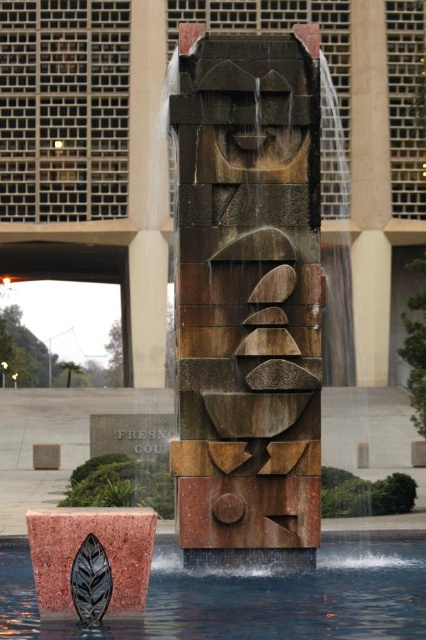
Which is more to the right, metallic water at leaf bottom or rustic stone sculpture at center?

Positioned to the right is metallic water at leaf bottom.

Who is taller, metallic water at leaf bottom or rustic stone sculpture at center?

rustic stone sculpture at center is taller.

Locate an element on the screen. Image resolution: width=426 pixels, height=640 pixels. metallic water at leaf bottom is located at coordinates 250,598.

Where is `metallic water at leaf bottom`? metallic water at leaf bottom is located at coordinates (250, 598).

Is rustic stone face at center below metallic water at leaf bottom?

No.

This screenshot has width=426, height=640. Describe the element at coordinates (247, 298) in the screenshot. I see `rustic stone face at center` at that location.

This screenshot has height=640, width=426. What are the coordinates of `rustic stone face at center` in the screenshot? It's located at (247, 298).

You are a GUI agent. You are given a task and a screenshot of the screen. Output one action in this format:
    pyautogui.click(x=<x>, y=<y>)
    Task: Click on the rustic stone face at center
    
    Given the screenshot: What is the action you would take?
    tap(247, 298)

Does rustic stone face at center have a lesser height compared to marble column at center-right?

Yes, rustic stone face at center is shorter than marble column at center-right.

Between point (308, 362) and point (362, 296), which one is positioned in front?

Positioned in front is point (308, 362).

The width and height of the screenshot is (426, 640). I want to click on rustic stone face at center, so click(247, 298).